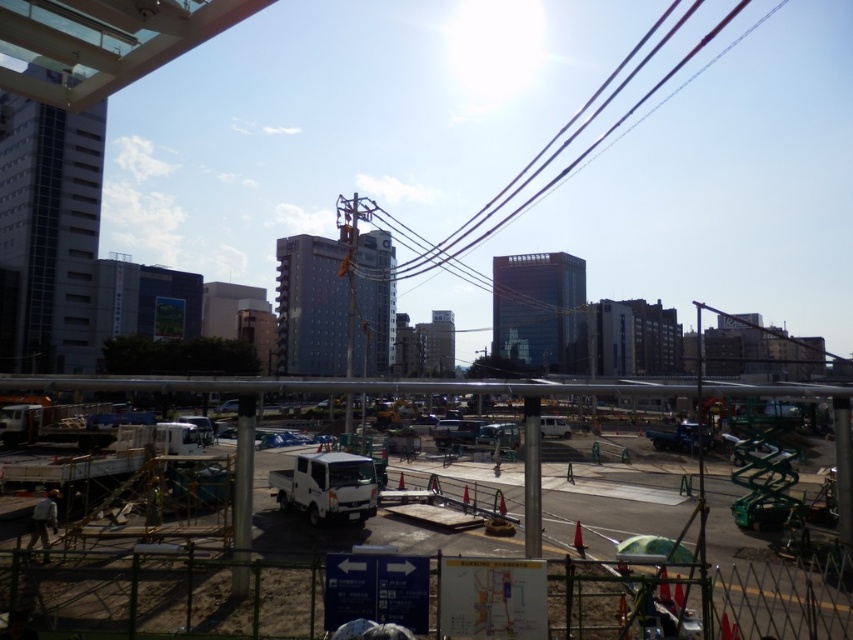
Question: Is white matte truck at center closer to camera compared to black wire at upper center?

Choices:
 (A) no
 (B) yes

Answer: (B)

Question: Among these points, which one is farthest from the camera?

Choices:
 (A) (636, 76)
 (B) (439, 392)

Answer: (A)

Question: Is white matte truck at center wider than black wire at upper center?

Choices:
 (A) no
 (B) yes

Answer: (A)

Question: Does white matte truck at center come behind black wire at upper center?

Choices:
 (A) no
 (B) yes

Answer: (A)

Question: Which of the following is the farthest from the observer?

Choices:
 (A) (515, 387)
 (B) (651, 68)

Answer: (B)

Question: Which point appears closest to the camera in this image?

Choices:
 (A) (25, 384)
 (B) (741, 17)

Answer: (A)